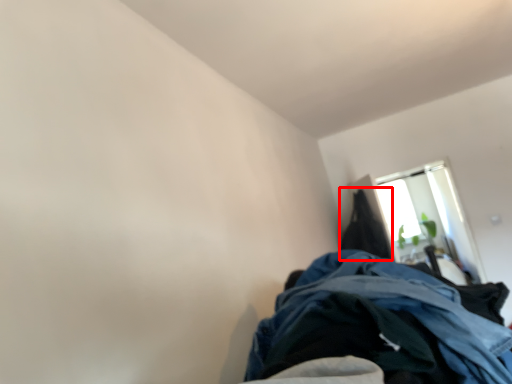
Question: Where is cloak (annotated by the red box) located in relation to window in the image?

Choices:
 (A) right
 (B) left

Answer: (B)